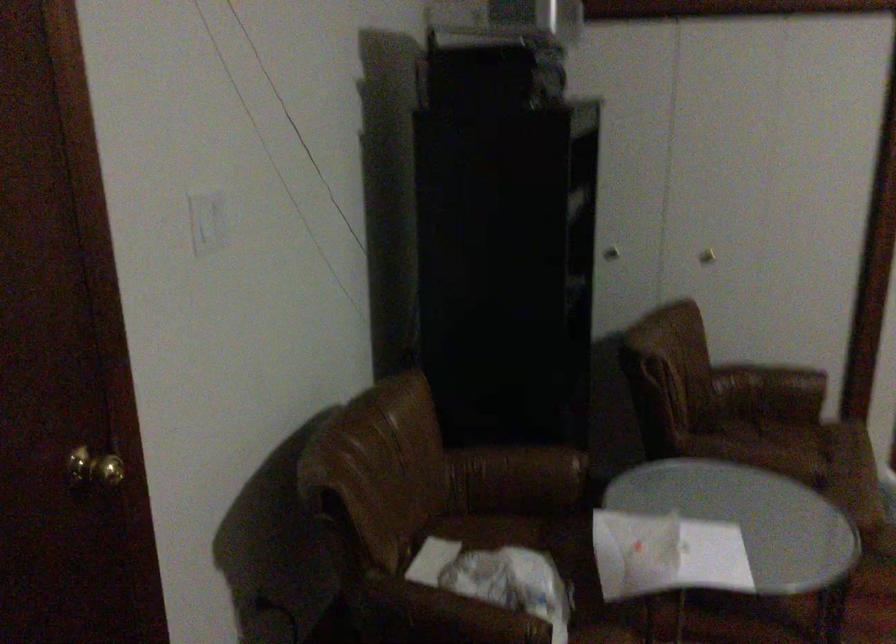
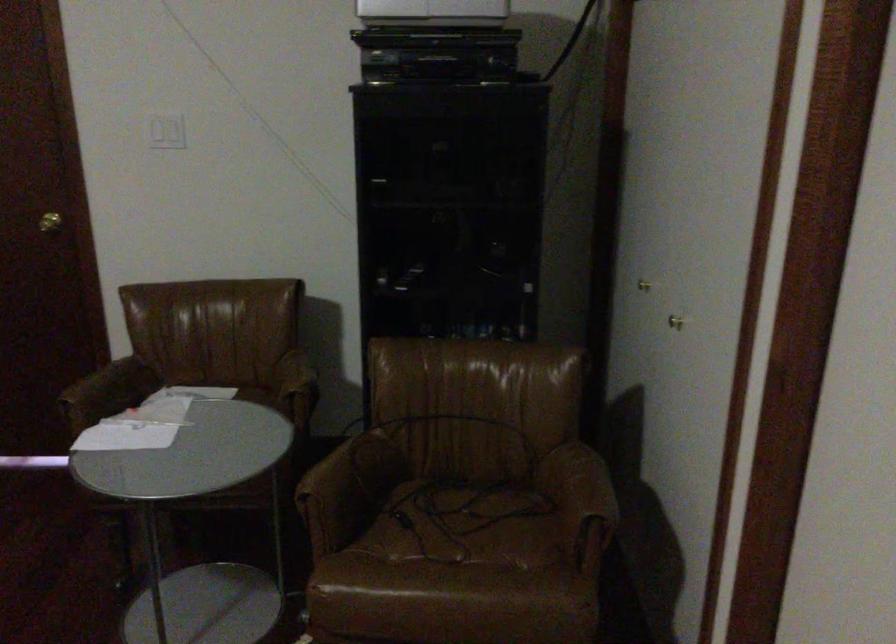
Locate, in the second image, the point that corresponds to point 760,448 in the first image.

(464, 525)